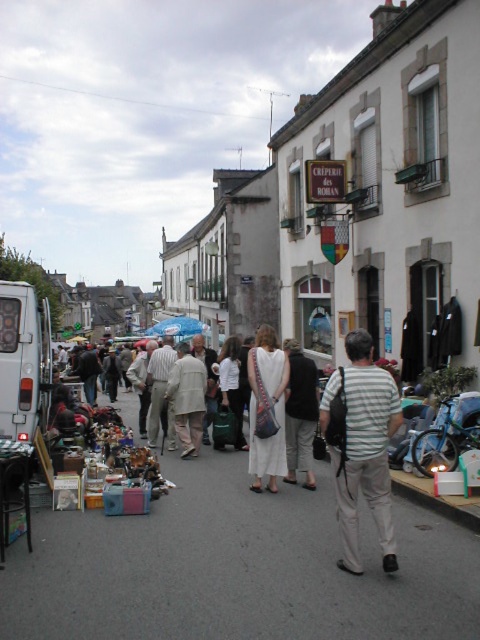
Question: Which point is farther from the camera taking this photo?

Choices:
 (A) (250, 452)
 (B) (299, 378)

Answer: (B)

Question: Is white fabric dress at center to the right of light beige fabric coat at center from the viewer's perspective?

Choices:
 (A) yes
 (B) no

Answer: (A)

Question: Is striped cotton shirt at center below white cotton dress at center?

Choices:
 (A) yes
 (B) no

Answer: (B)

Question: Which point is closer to the camera?

Choices:
 (A) coord(173,417)
 (B) coord(10,435)
 (C) coord(297,436)
 (D) coord(262,333)

Answer: (B)

Question: Which point is farther from the camera taking this photo?

Choices:
 (A) (254, 349)
 (B) (292, 364)
 (C) (200, 442)

Answer: (C)

Question: Observing the image, what is the correct spatial positioning of matte white van at left in reference to white fabric dress at center?

Choices:
 (A) above
 (B) below

Answer: (A)